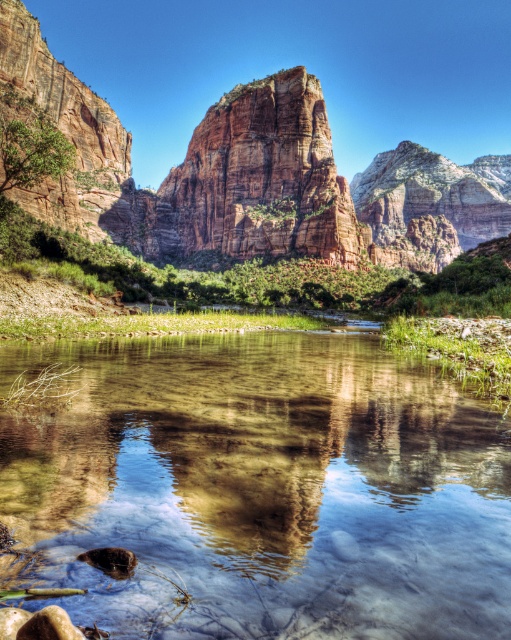
You are standing at the edge of the cliff in the image and see the point marked as point (262, 488). What can you observe about the water at that location?

The point (262, 488) indicates clear water at center, so you can observe clear water at that location.